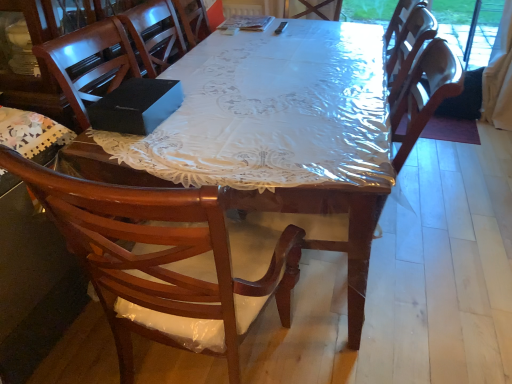
Identify the location of wooden desk at center. (274, 133).

The height and width of the screenshot is (384, 512). What do you see at coordinates (274, 133) in the screenshot?
I see `wooden desk at center` at bounding box center [274, 133].

What is the approximate height of wooden armchair at center?

The height of wooden armchair at center is 1.07 meters.

What do you see at coordinates (329, 231) in the screenshot? I see `wooden armchair at center` at bounding box center [329, 231].

Identify the location of wooden armchair at center. The height and width of the screenshot is (384, 512). (329, 231).

Locate an element on the screen. The height and width of the screenshot is (384, 512). wooden desk at center is located at coordinates (274, 133).

Considering the relative positions of wooden armchair at center and wooden desk at center in the image provided, is wooden armchair at center to the left or to the right of wooden desk at center?

In the image, wooden armchair at center appears on the left side of wooden desk at center.

Consider the image. Does wooden armchair at center lie in front of wooden desk at center?

No, it is behind wooden desk at center.

Which point is more distant from viewer, (359, 334) or (351, 262)?

The point (359, 334) is behind.

From the image's perspective, is wooden armchair at center located beneath wooden desk at center?

Indeed, from the image's perspective, wooden armchair at center is shown beneath wooden desk at center.

From a real-world perspective, is wooden armchair at center positioned over wooden desk at center based on gravity?

Correct, in the physical world, wooden armchair at center is higher than wooden desk at center.

Is wooden armchair at center wider than wooden desk at center?

Incorrect, the width of wooden armchair at center does not surpass that of wooden desk at center.

Which of these two, wooden armchair at center or wooden desk at center, stands taller?

wooden armchair at center.

Which of these two, wooden armchair at center or wooden desk at center, is bigger?

Bigger between the two is wooden desk at center.

Is wooden armchair at center not inside wooden desk at center?

Indeed, wooden armchair at center is completely outside wooden desk at center.

Is wooden armchair at center far away from wooden desk at center?

No, wooden armchair at center is not far away from wooden desk at center.

Is wooden armchair at center oriented away from wooden desk at center?

No.

This screenshot has width=512, height=384. I want to click on desk in front of the wooden armchair at center, so pos(274,133).

Considering the positions of objects wooden desk at center and wooden armchair at center in the image provided, who is more to the left, wooden desk at center or wooden armchair at center?

From the viewer's perspective, wooden armchair at center appears more on the left side.

Is wooden desk at center positioned behind wooden armchair at center?

No, it is in front of wooden armchair at center.

Which is behind, point (94, 154) or point (300, 221)?

The point (300, 221) is farther from the camera.

In the scene shown: From the image's perspective, is wooden desk at center over wooden armchair at center?

Yes.

From a real-world perspective, between wooden desk at center and wooden armchair at center, who is vertically higher?

wooden armchair at center, from a real-world perspective.

Between wooden desk at center and wooden armchair at center, which one has smaller width?

wooden armchair at center.

Which of these two, wooden desk at center or wooden armchair at center, stands shorter?

With less height is wooden desk at center.

Considering the sizes of objects wooden desk at center and wooden armchair at center in the image provided, who is smaller, wooden desk at center or wooden armchair at center?

With smaller size is wooden armchair at center.

Do you think wooden desk at center is within wooden armchair at center, or outside of it?

wooden desk at center is not inside wooden armchair at center, it's outside.

Can you see wooden desk at center touching wooden armchair at center?

No, wooden desk at center is not next to wooden armchair at center.

Is wooden armchair at center at the back of wooden desk at center?

That's not correct — wooden desk at center is not looking away from wooden armchair at center.

You are a GUI agent. You are given a task and a screenshot of the screen. Output one action in this format:
    pyautogui.click(x=<x>, y=<y>)
    Task: Click on the desk to the right of wooden armchair at center
    
    Given the screenshot: What is the action you would take?
    pyautogui.click(x=274, y=133)

Identify the location of armchair to the left of wooden desk at center. Image resolution: width=512 pixels, height=384 pixels. (329, 231).

You are a GUI agent. You are given a task and a screenshot of the screen. Output one action in this format:
    pyautogui.click(x=<x>, y=<y>)
    Task: Click on the desk on the right of wooden armchair at center
    The width and height of the screenshot is (512, 384).
    Given the screenshot: What is the action you would take?
    pyautogui.click(x=274, y=133)